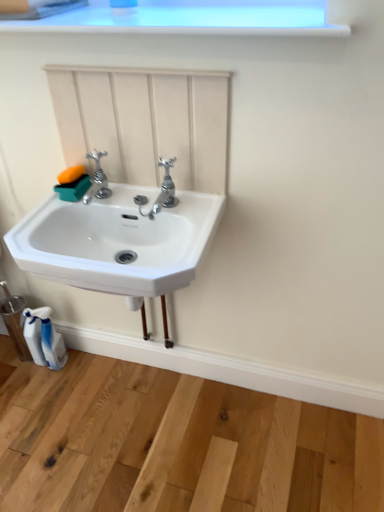
Question: From a real-world perspective, is polished chrome tap at center, placed as the 2th tap when sorted from right to left, above or below polished chrome faucet at center, the first tap positioned from the right?

Choices:
 (A) above
 (B) below

Answer: (B)

Question: Relative to polished chrome faucet at center, the first tap positioned from the right, is polished chrome tap at center, placed as the 2th tap when sorted from right to left, in front or behind?

Choices:
 (A) front
 (B) behind

Answer: (B)

Question: Which object is positioned farthest from the polished chrome faucet at center, which appears as the 2th tap when viewed from the left?

Choices:
 (A) white plastic spray bottle at lower left
 (B) polished chrome tap at center, the 1th tap viewed from the left
 (C) white ceramic sink at center
 (D) white plastic window frame at upper center

Answer: (A)

Question: Which object is positioned closest to the white plastic spray bottle at lower left?

Choices:
 (A) white plastic window frame at upper center
 (B) polished chrome tap at center, placed as the 2th tap when sorted from right to left
 (C) polished chrome faucet at center, which appears as the 2th tap when viewed from the left
 (D) white ceramic sink at center

Answer: (D)